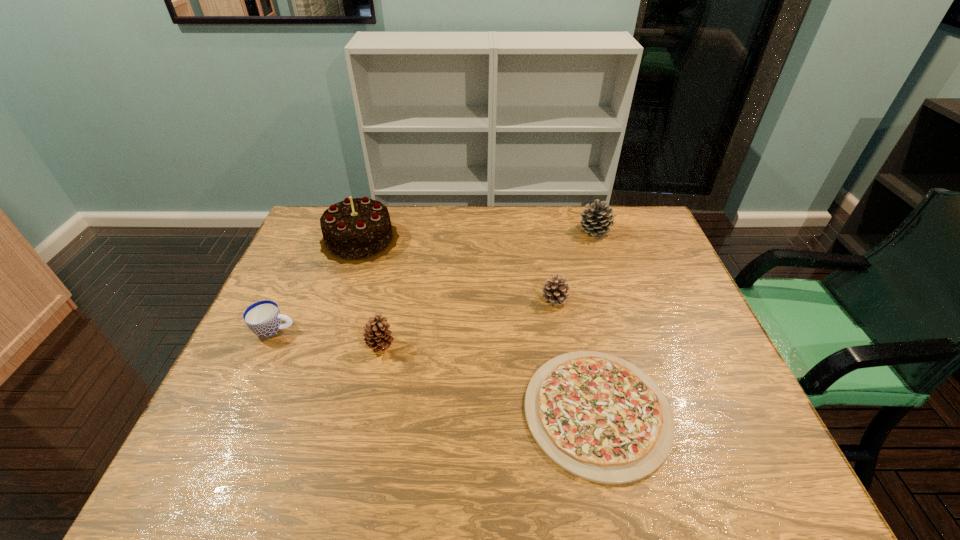
At what (x,y) coordinates should I click in order to perform the action: click on blank region between the second farthest pinecone and the cup. Please return your answer as a coordinate pair (x, y). Looking at the image, I should click on (415, 314).

Where is `empty space that is in between the leftmost pinecone and the rightmost pinecone`? empty space that is in between the leftmost pinecone and the rightmost pinecone is located at coordinates (488, 288).

Identify the location of vacant space in between the second shortest object and the rightmost pinecone. This screenshot has width=960, height=540. (435, 280).

This screenshot has height=540, width=960. Find the location of `vacant area that lies between the birthday cake and the shortest object`. vacant area that lies between the birthday cake and the shortest object is located at coordinates (478, 326).

Find the location of a particular element. Image resolution: width=960 pixels, height=540 pixels. vacant area between the farthest pinecone and the tallest object is located at coordinates (477, 235).

You are a GUI agent. You are given a task and a screenshot of the screen. Output one action in this format:
    pyautogui.click(x=<x>, y=<y>)
    Task: Click on the vacant region between the birthday cake and the pizza
    Image resolution: width=960 pixels, height=540 pixels.
    Given the screenshot: What is the action you would take?
    pyautogui.click(x=478, y=326)

Identify which object is located as the second nearest to the cup. Please provide its 2D coordinates. Your answer should be formatted as a tuple, i.e. [(x, y)], where the tuple contains the x and y coordinates of a point satisfying the conditions above.

[(359, 230)]

At what (x,y) coordinates should I click in order to perform the action: click on the fourth closest object to the leftmost pinecone. Please return your answer as a coordinate pair (x, y). Image resolution: width=960 pixels, height=540 pixels. Looking at the image, I should click on 555,291.

Find the location of a particular element. This screenshot has width=960, height=540. the third closest pinecone to the tallest object is located at coordinates (596, 221).

Identify which pinecone is located as the third nearest to the cup. Please provide its 2D coordinates. Your answer should be formatted as a tuple, i.e. [(x, y)], where the tuple contains the x and y coordinates of a point satisfying the conditions above.

[(596, 221)]